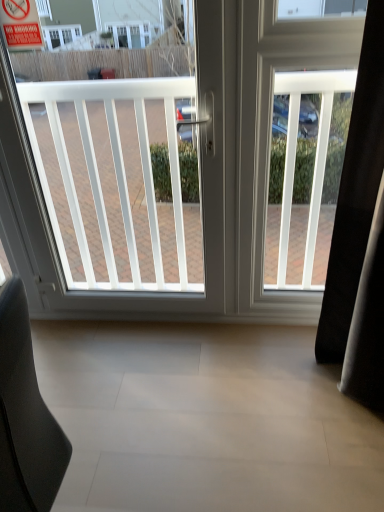
Question: Can you confirm if black leather chair at lower left is bigger than white plastic screen door at right?

Choices:
 (A) yes
 (B) no

Answer: (A)

Question: From a real-world perspective, is black leather chair at lower left beneath white plastic screen door at right?

Choices:
 (A) no
 (B) yes

Answer: (B)

Question: From the image's perspective, is black leather chair at lower left located beneath white plastic screen door at right?

Choices:
 (A) yes
 (B) no

Answer: (A)

Question: Is black leather chair at lower left behind white plastic screen door at right?

Choices:
 (A) yes
 (B) no

Answer: (B)

Question: Is black leather chair at lower left to the right of white plastic screen door at right from the viewer's perspective?

Choices:
 (A) yes
 (B) no

Answer: (B)

Question: Can you confirm if black leather chair at lower left is smaller than white plastic screen door at right?

Choices:
 (A) no
 (B) yes

Answer: (A)

Question: Considering the relative sizes of red plastic sign at upper left and white plastic window at center in the image provided, is red plastic sign at upper left shorter than white plastic window at center?

Choices:
 (A) yes
 (B) no

Answer: (A)

Question: Is red plastic sign at upper left taller than white plastic window at center?

Choices:
 (A) yes
 (B) no

Answer: (B)

Question: Is red plastic sign at upper left positioned far away from white plastic window at center?

Choices:
 (A) no
 (B) yes

Answer: (A)

Question: Is white plastic window at center surrounded by red plastic sign at upper left?

Choices:
 (A) yes
 (B) no

Answer: (B)

Question: Does red plastic sign at upper left have a greater width compared to white plastic window at center?

Choices:
 (A) no
 (B) yes

Answer: (A)

Question: Is red plastic sign at upper left not within white plastic window at center?

Choices:
 (A) yes
 (B) no

Answer: (B)

Question: Does white plastic window at center have a larger size compared to red plastic sign at upper left?

Choices:
 (A) no
 (B) yes

Answer: (B)